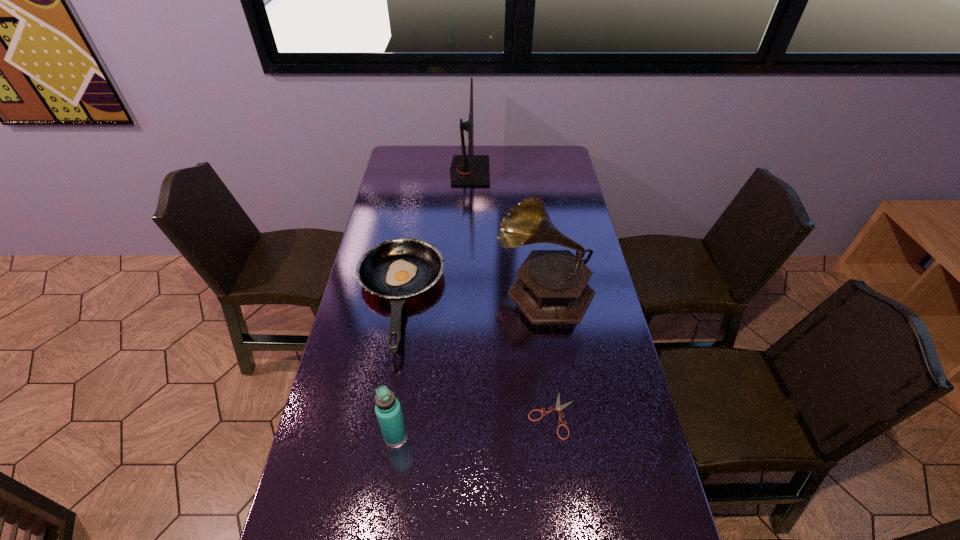
Identify the location of vacant space that satisfies the following two spatial constraints: 1. on the screen side of the monitor; 2. on the front side of the thermos bottle. (462, 435).